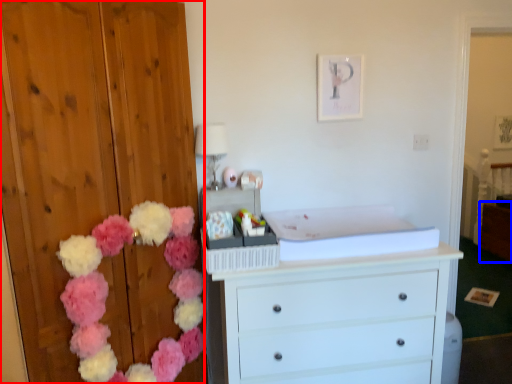
Question: Which object is closer to the camera taking this photo, dresser (highlighted by a red box) or cabinetry (highlighted by a blue box)?

Choices:
 (A) dresser
 (B) cabinetry

Answer: (A)